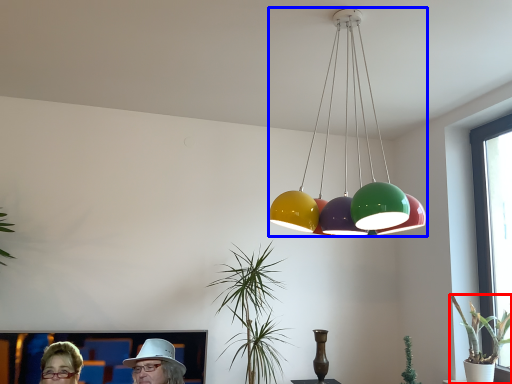
Question: Which object appears closest to the camera in this image, houseplant (highlighted by a red box) or lamp (highlighted by a blue box)?

Choices:
 (A) houseplant
 (B) lamp

Answer: (B)